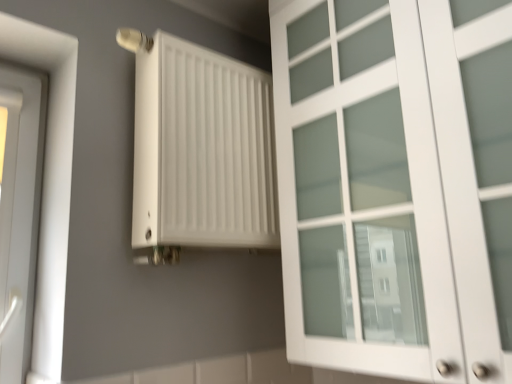
Question: Does white matte cabinet at right have a greater width compared to white matte radiator at upper left?

Choices:
 (A) yes
 (B) no

Answer: (A)

Question: Is the position of white matte cabinet at right less distant than that of white matte radiator at upper left?

Choices:
 (A) no
 (B) yes

Answer: (B)

Question: Is white matte cabinet at right facing away from white matte radiator at upper left?

Choices:
 (A) yes
 (B) no

Answer: (B)

Question: Is white matte cabinet at right in contact with white matte radiator at upper left?

Choices:
 (A) no
 (B) yes

Answer: (A)

Question: From the image's perspective, is white matte cabinet at right located above white matte radiator at upper left?

Choices:
 (A) yes
 (B) no

Answer: (A)

Question: Is white matte cabinet at right surrounding white matte radiator at upper left?

Choices:
 (A) yes
 (B) no

Answer: (B)

Question: Is white matte radiator at upper left to the right of white matte cabinet at right from the viewer's perspective?

Choices:
 (A) yes
 (B) no

Answer: (B)

Question: From the image's perspective, is white matte radiator at upper left under white matte cabinet at right?

Choices:
 (A) yes
 (B) no

Answer: (A)

Question: Does white matte radiator at upper left have a smaller size compared to white matte cabinet at right?

Choices:
 (A) yes
 (B) no

Answer: (A)

Question: Is white matte radiator at upper left facing away from white matte cabinet at right?

Choices:
 (A) no
 (B) yes

Answer: (A)

Question: Is white matte radiator at upper left positioned far away from white matte cabinet at right?

Choices:
 (A) no
 (B) yes

Answer: (A)

Question: Does white matte radiator at upper left appear on the left side of white matte cabinet at right?

Choices:
 (A) yes
 (B) no

Answer: (A)

Question: Does point (192, 238) appear closer or farther from the camera than point (361, 196)?

Choices:
 (A) farther
 (B) closer

Answer: (A)